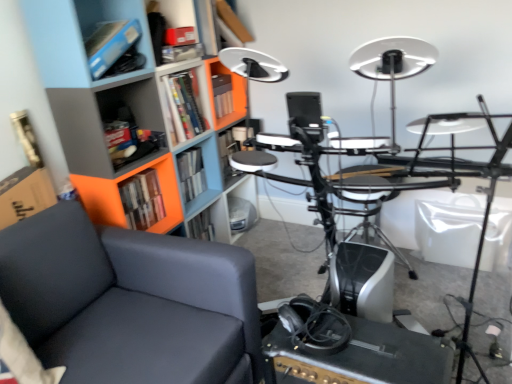
Question: Is matte plastic shelf at center, which appears as the second shelf when viewed from the top, taller than hardcover book at center, marked as the first book in a front-to-back arrangement?

Choices:
 (A) no
 (B) yes

Answer: (B)

Question: Is matte plastic shelf at center, which appears as the second shelf when viewed from the top, further to camera compared to hardcover book at center, the second book from the back?

Choices:
 (A) no
 (B) yes

Answer: (B)

Question: Is matte plastic shelf at center, marked as the 3th shelf in a front-to-back arrangement, positioned before hardcover book at center, marked as the first book in a front-to-back arrangement?

Choices:
 (A) yes
 (B) no

Answer: (B)

Question: Considering the relative sizes of matte plastic shelf at center, which appears as the second shelf when viewed from the top, and hardcover book at center, the second book from the back, in the image provided, is matte plastic shelf at center, which appears as the second shelf when viewed from the top, wider than hardcover book at center, the second book from the back,?

Choices:
 (A) yes
 (B) no

Answer: (A)

Question: Is hardcover book at center, marked as the first book in a front-to-back arrangement, a part of matte plastic shelf at center, acting as the 2th shelf starting from the back?

Choices:
 (A) yes
 (B) no

Answer: (B)

Question: Considering the relative positions of matte plastic shelf at center, positioned as the 3th shelf in bottom-to-top order, and hardcover book at center, the second book from the back, in the image provided, is matte plastic shelf at center, positioned as the 3th shelf in bottom-to-top order, to the right of hardcover book at center, the second book from the back, from the viewer's perspective?

Choices:
 (A) yes
 (B) no

Answer: (A)

Question: Does black plastic computer desk at center appear on the left side of black matte amplifier at lower center?

Choices:
 (A) yes
 (B) no

Answer: (B)

Question: Are black plastic computer desk at center and black matte amplifier at lower center located far from each other?

Choices:
 (A) yes
 (B) no

Answer: (B)

Question: Can you confirm if black plastic computer desk at center is shorter than black matte amplifier at lower center?

Choices:
 (A) no
 (B) yes

Answer: (A)

Question: From the image's perspective, is black plastic computer desk at center on top of black matte amplifier at lower center?

Choices:
 (A) no
 (B) yes

Answer: (B)

Question: Is black plastic computer desk at center taller than black matte amplifier at lower center?

Choices:
 (A) no
 (B) yes

Answer: (B)

Question: Can you confirm if black plastic computer desk at center is bigger than black matte amplifier at lower center?

Choices:
 (A) yes
 (B) no

Answer: (A)

Question: Is orange plastic bookcase at left far away from matte plastic shelf at center, acting as the 2th shelf starting from the back?

Choices:
 (A) yes
 (B) no

Answer: (B)